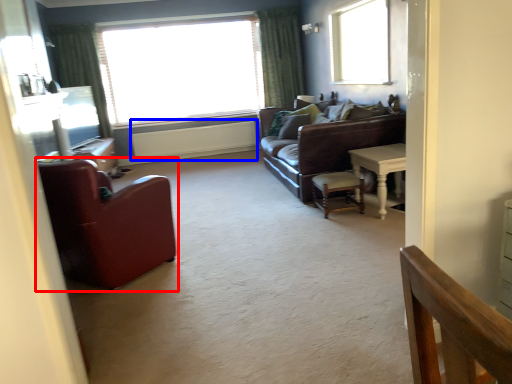
Question: Which object appears farthest to the camera in this image, chair (highlighted by a red box) or radiator (highlighted by a blue box)?

Choices:
 (A) chair
 (B) radiator

Answer: (B)